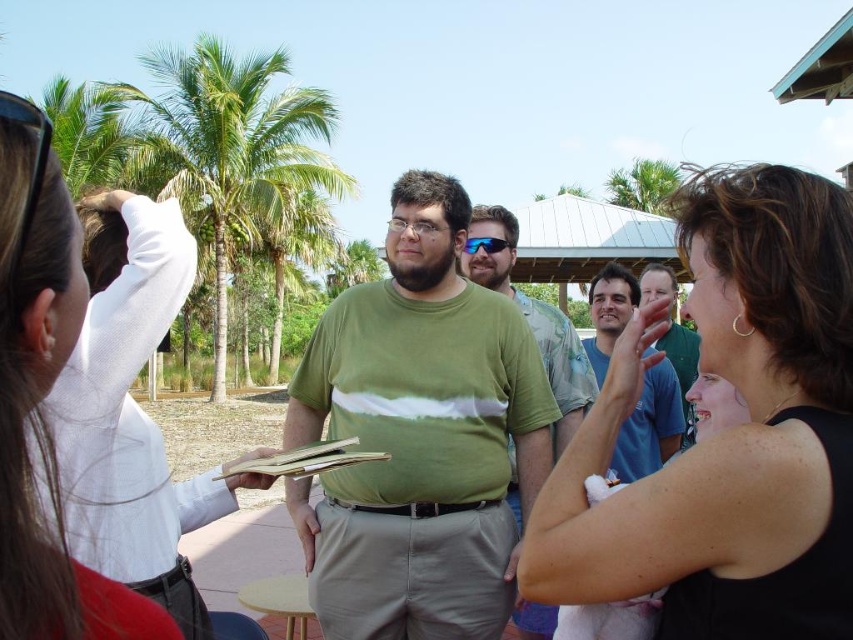
Describe the element at coordinates (650, 426) in the screenshot. I see `blue cotton shirt at center` at that location.

Between blue cotton shirt at center and black plastic sunglasses at upper left, which one has less height?

black plastic sunglasses at upper left

Which is behind, point (630, 316) or point (33, 205)?

The point (630, 316) is behind.

Find the location of a particular element. blue cotton shirt at center is located at coordinates (650, 426).

Locate an element on the screen. This screenshot has height=640, width=853. green leafy palm tree at upper center is located at coordinates (643, 184).

Between green leafy palm tree at upper center and black plastic sunglasses at upper left, which one has less height?

With less height is black plastic sunglasses at upper left.

Does point (648, 192) come farther from viewer compared to point (7, 92)?

Yes, it is.

This screenshot has height=640, width=853. I want to click on green leafy palm tree at upper center, so click(x=643, y=184).

The height and width of the screenshot is (640, 853). In order to click on green leafy palm tree at upper left in this screenshot , I will do `click(233, 148)`.

Does green leafy palm tree at upper left have a smaller size compared to green t-shirt at center?

Incorrect, green leafy palm tree at upper left is not smaller in size than green t-shirt at center.

Image resolution: width=853 pixels, height=640 pixels. Describe the element at coordinates (233, 148) in the screenshot. I see `green leafy palm tree at upper left` at that location.

Locate an element on the screen. This screenshot has width=853, height=640. green leafy palm tree at upper left is located at coordinates (233, 148).